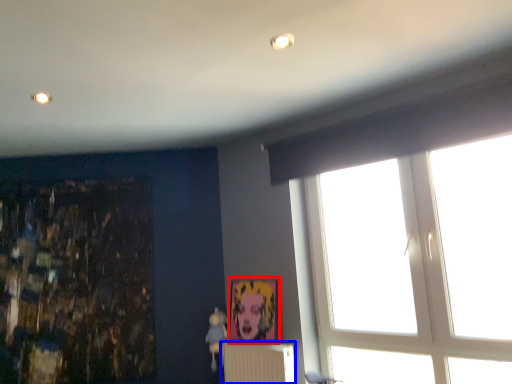
Question: Which object is closer to the camera taking this photo, picture frame (highlighted by a red box) or radiator (highlighted by a blue box)?

Choices:
 (A) picture frame
 (B) radiator

Answer: (B)